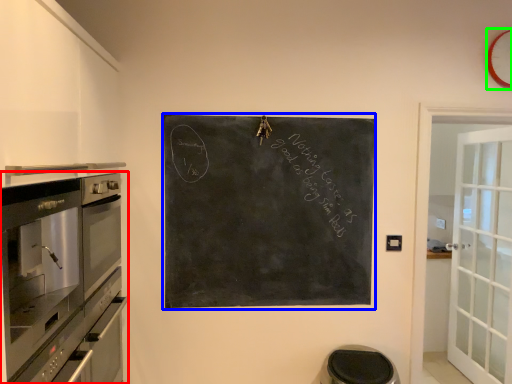
Question: Which object is the closest to the home appliance (highlighted by a red box)? Choose among these: bulletin board (highlighted by a blue box) or clock (highlighted by a green box).

Choices:
 (A) bulletin board
 (B) clock

Answer: (A)